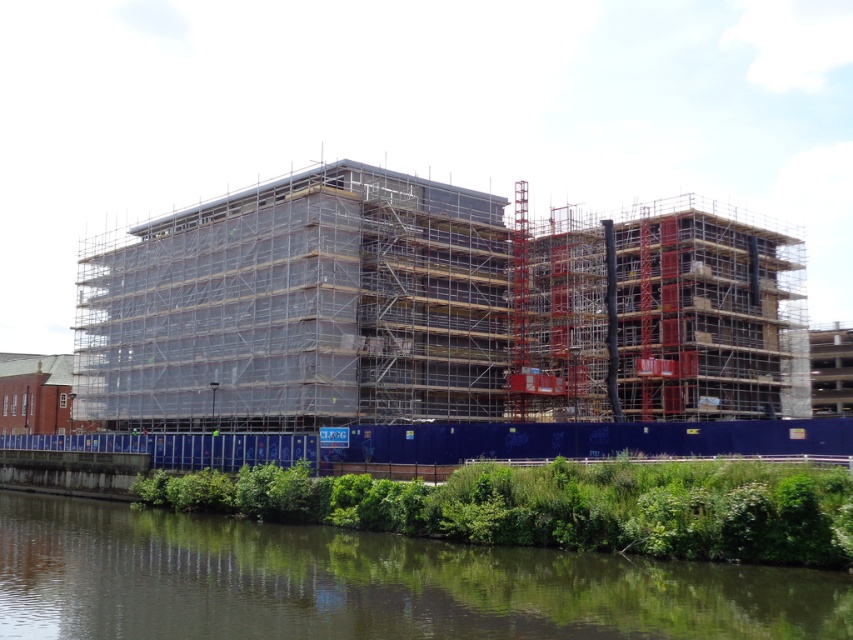
Question: Which point is farther from the camera taking this photo?

Choices:
 (A) (749, 566)
 (B) (297, 416)

Answer: (B)

Question: Does clear plastic scaffolding at center appear on the left side of green leafy vegetation at lower center?

Choices:
 (A) yes
 (B) no

Answer: (B)

Question: Is clear plastic scaffolding at center positioned before green leafy vegetation at lower center?

Choices:
 (A) no
 (B) yes

Answer: (A)

Question: Among these objects, which one is farthest from the camera?

Choices:
 (A) green leafy vegetation at lower center
 (B) clear plastic scaffolding at center

Answer: (B)

Question: Does clear plastic scaffolding at center come in front of green leafy vegetation at lower center?

Choices:
 (A) no
 (B) yes

Answer: (A)